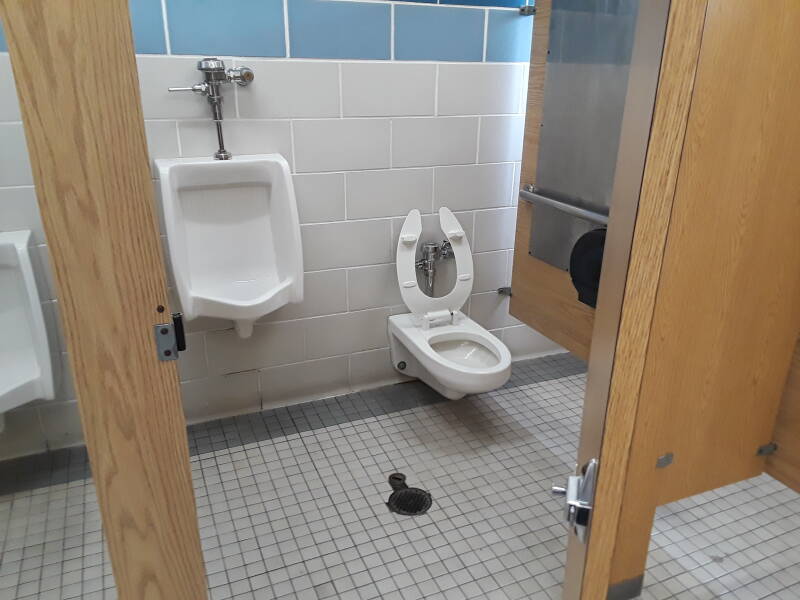
Locate an element on the screen. toilet paper dispenser is located at coordinates (589, 266).